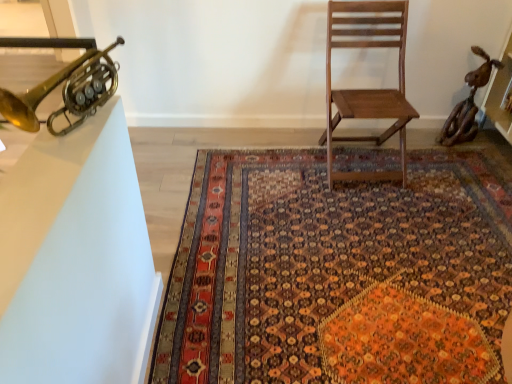
This screenshot has width=512, height=384. What are the coordinates of `blank area beneath wooden chair at center (from a real-world perspective)` in the screenshot? It's located at (356, 160).